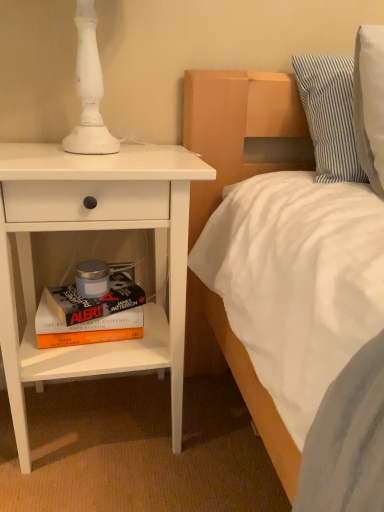
I want to click on hardcover book at lower left, so click(x=91, y=313).

The height and width of the screenshot is (512, 384). I want to click on white matte nightstand at left, so click(95, 229).

Find the location of `hardcover book at lower left`. hardcover book at lower left is located at coordinates (91, 313).

From the image's perspective, which one is positioned higher, white matte nightstand at left or hardcover book at lower left?

white matte nightstand at left, from the image's perspective.

How far apart are white matte nightstand at left and hardcover book at lower left?

A distance of 6.26 inches exists between white matte nightstand at left and hardcover book at lower left.

Visually, is white matte nightstand at left positioned to the left or to the right of hardcover book at lower left?

white matte nightstand at left is positioned on hardcover book at lower left's right side.

Considering the relative positions of blue striped pillow at upper right and hardcover book at lower left in the image provided, is blue striped pillow at upper right to the left or to the right of hardcover book at lower left?

blue striped pillow at upper right is to the right of hardcover book at lower left.

Considering the sizes of blue striped pillow at upper right and hardcover book at lower left in the image, is blue striped pillow at upper right wider or thinner than hardcover book at lower left?

Clearly, blue striped pillow at upper right has more width compared to hardcover book at lower left.

From a real-world perspective, is blue striped pillow at upper right on top of hardcover book at lower left?

Yes, from a real-world perspective, blue striped pillow at upper right is over hardcover book at lower left

Which of these two, blue striped pillow at upper right or white matte nightstand at left, is wider?

Wider between the two is white matte nightstand at left.

From the image's perspective, is blue striped pillow at upper right above or below white matte nightstand at left?

Based on their image positions, blue striped pillow at upper right is located above white matte nightstand at left.

This screenshot has width=384, height=512. I want to click on pillow that is above the white matte nightstand at left (from a real-world perspective), so click(330, 115).

Is hardcover book at lower left to the right of blue striped pillow at upper right from the viewer's perspective?

In fact, hardcover book at lower left is to the left of blue striped pillow at upper right.

Who is more distant, hardcover book at lower left or blue striped pillow at upper right?

hardcover book at lower left is more distant.

Does point (131, 278) come in front of point (333, 143)?

No, (131, 278) is further to viewer.

Considering the positions of point (96, 341) and point (136, 370), is point (96, 341) closer or farther from the camera than point (136, 370)?

Point (96, 341) is positioned farther from the camera compared to point (136, 370).

Based on the photo, considering the relative sizes of hardcover book at lower left and white matte nightstand at left in the image provided, is hardcover book at lower left thinner than white matte nightstand at left?

Correct, the width of hardcover book at lower left is less than that of white matte nightstand at left.

Is hardcover book at lower left facing towards white matte nightstand at left?

Yes, hardcover book at lower left is turned towards white matte nightstand at left.

Can you tell me how much white matte nightstand at left and blue striped pillow at upper right differ in facing direction?

The angle between the facing direction of white matte nightstand at left and the facing direction of blue striped pillow at upper right is 0.335 degrees.

From the image's perspective, which is above, white matte nightstand at left or blue striped pillow at upper right?

blue striped pillow at upper right.

From their relative heights in the image, would you say white matte nightstand at left is taller or shorter than blue striped pillow at upper right?

Clearly, white matte nightstand at left is taller compared to blue striped pillow at upper right.

Can blue striped pillow at upper right be found inside white matte nightstand at left?

Actually, blue striped pillow at upper right is outside white matte nightstand at left.

Find the location of a particular element. nightstand above the hardcover book at lower left (from the image's perspective) is located at coordinates (95, 229).

Locate an element on the screen. book behind the blue striped pillow at upper right is located at coordinates (91, 313).

When comparing their distances from blue striped pillow at upper right, does hardcover book at lower left or white matte nightstand at left seem further?

Among the two, hardcover book at lower left is located further to blue striped pillow at upper right.

Estimate the real-world distances between objects in this image. Which object is further from white matte nightstand at left, hardcover book at lower left or blue striped pillow at upper right?

blue striped pillow at upper right is positioned further to the anchor white matte nightstand at left.

Based on their spatial positions, is blue striped pillow at upper right or white matte nightstand at left further from hardcover book at lower left?

blue striped pillow at upper right is further to hardcover book at lower left.

Looking at this image, estimate the real-world distances between objects in this image. Which object is closer to blue striped pillow at upper right, white matte nightstand at left or hardcover book at lower left?

Among the two, white matte nightstand at left is located nearer to blue striped pillow at upper right.

In the scene shown: Estimate the real-world distances between objects in this image. Which object is further from hardcover book at lower left, white matte nightstand at left or blue striped pillow at upper right?

Based on the image, blue striped pillow at upper right appears to be further to hardcover book at lower left.

Considering their positions, is blue striped pillow at upper right positioned further to white matte nightstand at left than hardcover book at lower left?

blue striped pillow at upper right is further to white matte nightstand at left.

The height and width of the screenshot is (512, 384). In order to click on nightstand between hardcover book at lower left and blue striped pillow at upper right in this screenshot , I will do `click(95, 229)`.